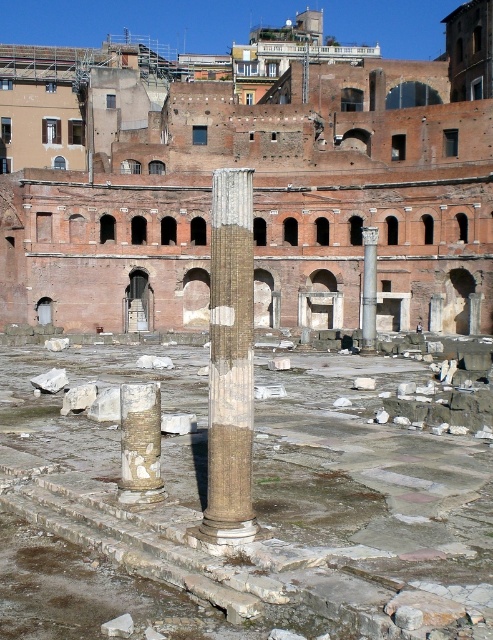
Question: Is brown stone amphitheater at center to the left of brown stone column at center from the viewer's perspective?

Choices:
 (A) no
 (B) yes

Answer: (B)

Question: Among these points, which one is nearest to the camera?

Choices:
 (A) (240, 336)
 (B) (302, 161)
 (C) (363, 349)

Answer: (A)

Question: Does speckled stone column at center appear over smooth stone column at center?

Choices:
 (A) yes
 (B) no

Answer: (B)

Question: Which of these objects is positioned closest to the smooth stone column at center?

Choices:
 (A) brown stone column at center
 (B) speckled stone column at center
 (C) brown stone amphitheater at center

Answer: (C)

Question: Can you confirm if brown stone amphitheater at center is smaller than smooth stone column at center?

Choices:
 (A) no
 (B) yes

Answer: (A)

Question: Which point is closer to the camera taking this photo?

Choices:
 (A) (246, 528)
 (B) (365, 132)

Answer: (A)